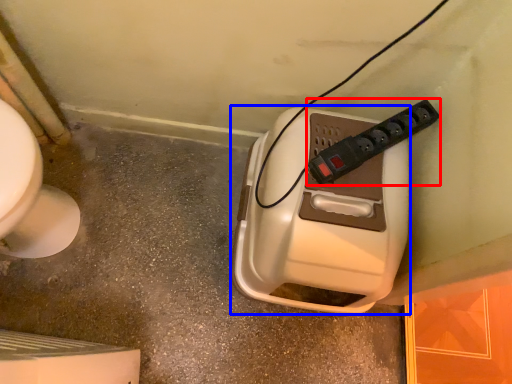
Question: Which of the following is the closest to the observer, power plugs and sockets (highlighted by a red box) or hand dryer (highlighted by a blue box)?

Choices:
 (A) power plugs and sockets
 (B) hand dryer

Answer: (B)